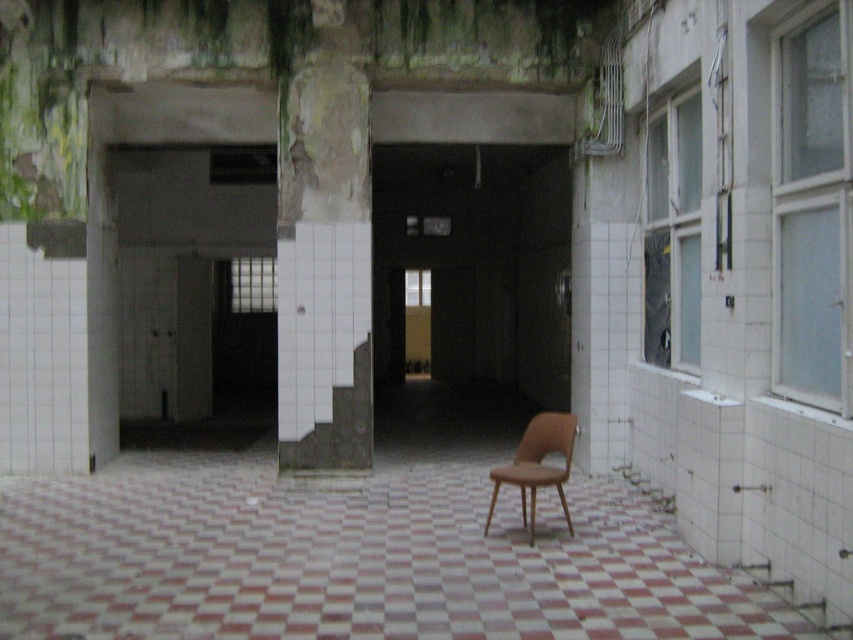
Between white tile pillar at center and brown leather chair at center, which one is positioned lower?

brown leather chair at center is lower down.

Where is `white tile pillar at center`? This screenshot has height=640, width=853. white tile pillar at center is located at coordinates pyautogui.click(x=323, y=252).

This screenshot has width=853, height=640. I want to click on white tile pillar at center, so click(323, 252).

What do you see at coordinates (357, 563) in the screenshot? I see `white checkered tile at center` at bounding box center [357, 563].

Who is shorter, white checkered tile at center or brown leather chair at center?

With less height is white checkered tile at center.

Between point (630, 492) and point (543, 413), which one is positioned behind?

The point (543, 413) is more distant.

Where is `white checkered tile at center`? The width and height of the screenshot is (853, 640). white checkered tile at center is located at coordinates (357, 563).

Who is more forward, (251,500) or (339,13)?

Point (251,500)

The height and width of the screenshot is (640, 853). I want to click on white checkered tile at center, so click(357, 563).